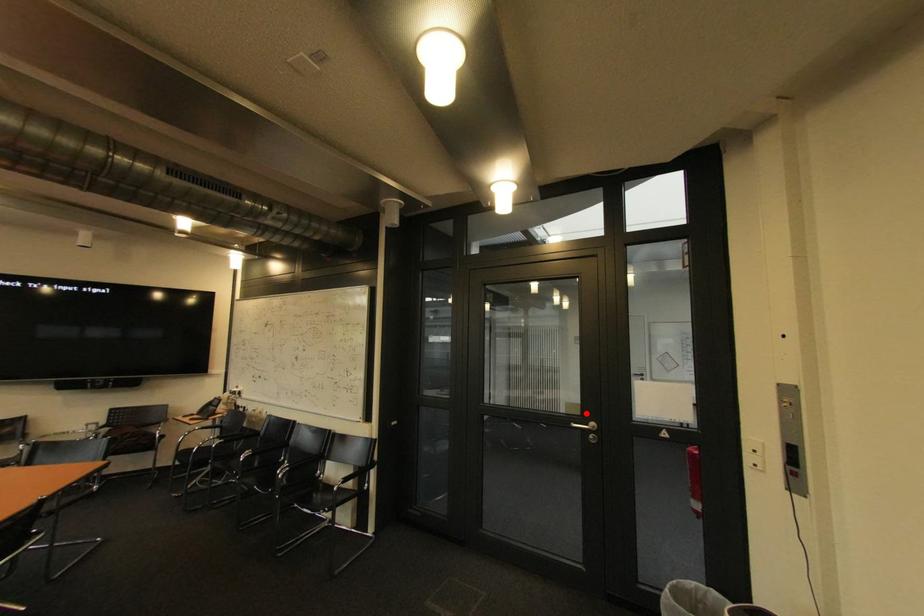
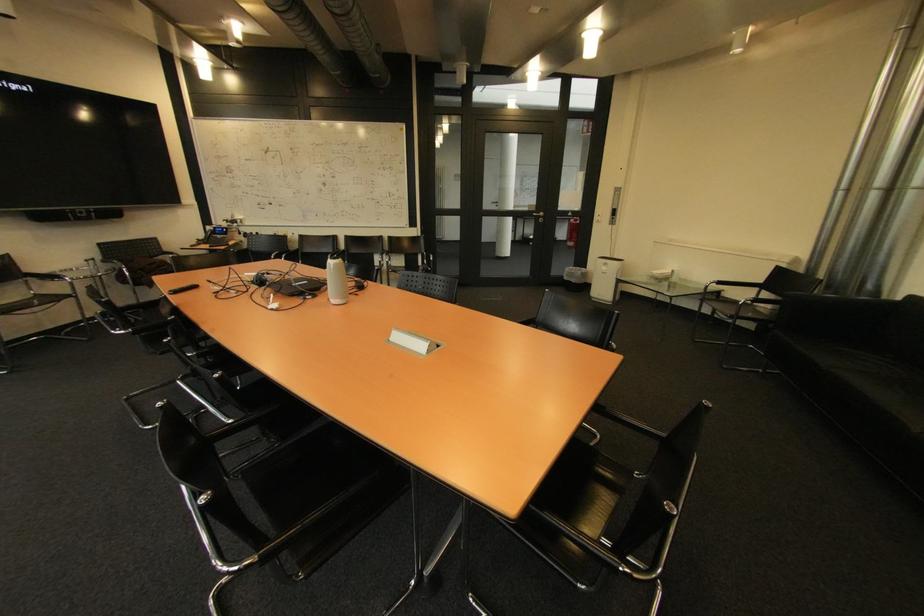
In the second image, find the point that corresponds to the highlighted location in the first image.

(542, 209)